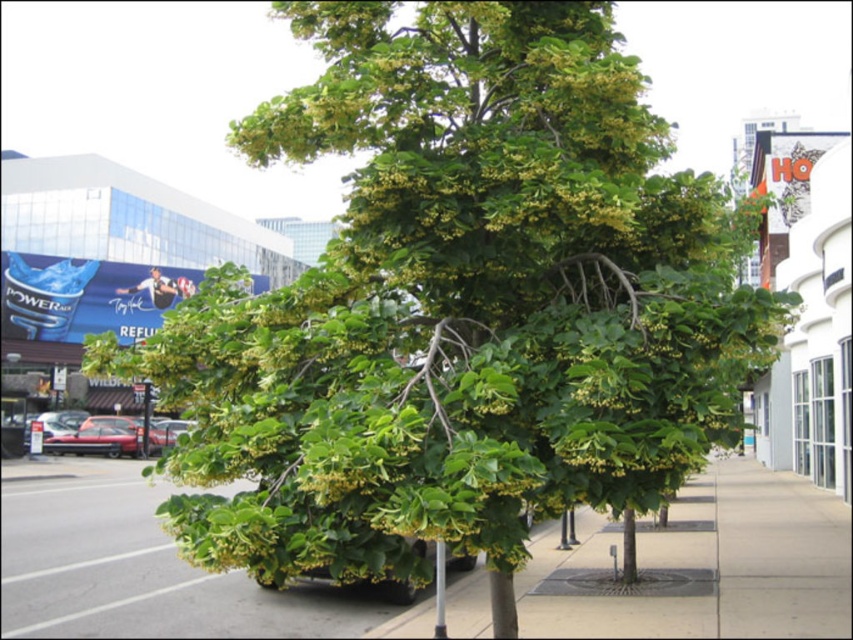
You are a pedestrian standing on the sidewalk and want to reach the metallic silver pole at lower center. Which direction should you move relative to the green leafy tree at center?

Since the green leafy tree at center is closer to you than the metallic silver pole at lower center, you should move away from the green leafy tree at center to reach the metallic silver pole at lower center.

You are standing on the sidewalk and see the green leafy tree at center and the metallic silver pole at lower center. Which object is closer to your left side?

The green leafy tree at center is to the left of the metallic silver pole at lower center, so it is closer to your left side.

You are a drone operator trying to capture a photo of the green leafy tree at center. Your drone is currently hovering at position coordinates of point 0.7, 0.7. To get the best shot, you need to move the drone to the exact location of the tree. What direction should you move the drone to reach the tree?

The green leafy tree at center is located at point (708, 564). Since the drone is at (596, 448), you should move it northeast to reach the tree.